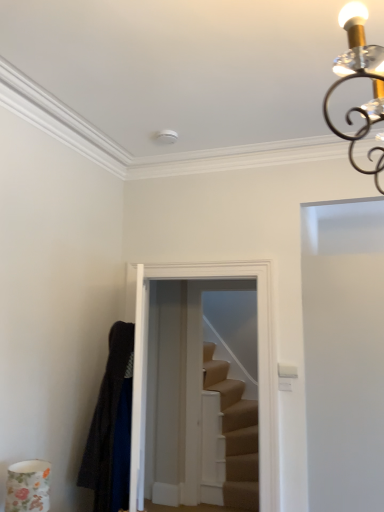
Image resolution: width=384 pixels, height=512 pixels. Describe the element at coordinates (344, 354) in the screenshot. I see `white matte door at right` at that location.

You are a GUI agent. You are given a task and a screenshot of the screen. Output one action in this format:
    pyautogui.click(x=<x>, y=<y>)
    Task: Click on the dark woolen robe at left
    
    Given the screenshot: What is the action you would take?
    pyautogui.click(x=111, y=426)

At what (x,y) coordinates should I click in order to perform the action: click on beige carpeted stairs at center. Please return your answer as a coordinate pair (x, y). This screenshot has height=512, width=384. Looking at the image, I should click on (235, 433).

Are beige carpeted stairs at center and white matte door at right making contact?

beige carpeted stairs at center is not next to white matte door at right, and they're not touching.

Is beige carpeted stairs at center smaller than white matte door at right?

Indeed, beige carpeted stairs at center has a smaller size compared to white matte door at right.

How different are the orientations of beige carpeted stairs at center and white matte door at right in degrees?

The angle between the facing direction of beige carpeted stairs at center and the facing direction of white matte door at right is 90 degrees.

Which is less distant, (253,488) or (351,474)?

Point (253,488) is farther from the camera than point (351,474).

Based on their sizes in the image, would you say clear glass door at center is bigger or smaller than white matte door at right?

clear glass door at center is smaller than white matte door at right.

From the image's perspective, between clear glass door at center and white matte door at right, which one is located above?

clear glass door at center, from the image's perspective.

Between clear glass door at center and white matte door at right, which one has more height?

white matte door at right.

Is the position of clear glass door at center more distant than that of white matte door at right?

Yes.

From the image's perspective, is white matte door at right below clear glass door at center?

Yes, from the image's perspective, white matte door at right is beneath clear glass door at center.

Is white matte door at right facing towards clear glass door at center?

No, white matte door at right is not oriented towards clear glass door at center.

Considering the relative sizes of white matte door at right and clear glass door at center in the image provided, is white matte door at right thinner than clear glass door at center?

In fact, white matte door at right might be wider than clear glass door at center.

In the image, is white matte door at right positioned in front of or behind clear glass door at center?

Clearly, white matte door at right is in front of clear glass door at center.

Considering the sizes of objects beige carpeted stairs at center and clear glass door at center in the image provided, who is wider, beige carpeted stairs at center or clear glass door at center?

With larger width is clear glass door at center.

Which object is further away from the camera, beige carpeted stairs at center or clear glass door at center?

beige carpeted stairs at center is further from the camera.

From the image's perspective, is beige carpeted stairs at center below clear glass door at center?

Correct, beige carpeted stairs at center appears lower than clear glass door at center in the image.

Is dark woolen robe at left oriented away from white matte door at right?

No.

Consider the image. From a real-world perspective, is dark woolen robe at left above or below white matte door at right?

dark woolen robe at left is above white matte door at right.

How distant is dark woolen robe at left from white matte door at right?

dark woolen robe at left is 1.31 meters away from white matte door at right.

Between dark woolen robe at left and white matte door at right, which one has more height?

white matte door at right is taller.

Is white matte door at right taller or shorter than dark woolen robe at left?

In the image, white matte door at right appears to be taller than dark woolen robe at left.

From a real-world perspective, does white matte door at right sit lower than dark woolen robe at left?

Yes, from a real-world perspective, white matte door at right is under dark woolen robe at left.

Is white matte door at right oriented away from dark woolen robe at left?

No.

Considering the relative sizes of dark woolen robe at left and beige carpeted stairs at center in the image provided, is dark woolen robe at left thinner than beige carpeted stairs at center?

No.

Are dark woolen robe at left and beige carpeted stairs at center making contact?

dark woolen robe at left and beige carpeted stairs at center are not in contact.

From the image's perspective, is dark woolen robe at left located above or below beige carpeted stairs at center?

dark woolen robe at left is above beige carpeted stairs at center.

Is dark woolen robe at left looking in the opposite direction of beige carpeted stairs at center?

dark woolen robe at left does not have its back to beige carpeted stairs at center.

This screenshot has height=512, width=384. I want to click on door that is on the right side of beige carpeted stairs at center, so click(x=344, y=354).

Where is `glass door that appears on the left of white matte door at right`? The height and width of the screenshot is (512, 384). glass door that appears on the left of white matte door at right is located at coordinates (258, 364).

Considering their positions, is beige carpeted stairs at center positioned further to dark woolen robe at left than clear glass door at center?

Based on the image, beige carpeted stairs at center appears to be further to dark woolen robe at left.

When comparing their distances from dark woolen robe at left, does clear glass door at center or beige carpeted stairs at center seem closer?

clear glass door at center is positioned closer to the anchor dark woolen robe at left.

Which object lies nearer to the anchor point beige carpeted stairs at center, dark woolen robe at left or white matte door at right?

white matte door at right lies closer to beige carpeted stairs at center than the other object.

When comparing their distances from dark woolen robe at left, does white matte door at right or beige carpeted stairs at center seem closer?

white matte door at right.

Estimate the real-world distances between objects in this image. Which object is further from beige carpeted stairs at center, white matte door at right or dark woolen robe at left?

dark woolen robe at left is positioned further to the anchor beige carpeted stairs at center.

Which object lies further to the anchor point white matte door at right, clear glass door at center or beige carpeted stairs at center?

Among the two, beige carpeted stairs at center is located further to white matte door at right.

Considering their positions, is white matte door at right positioned further to clear glass door at center than beige carpeted stairs at center?

beige carpeted stairs at center is further to clear glass door at center.

Looking at the image, which one is located closer to clear glass door at center, beige carpeted stairs at center or white matte door at right?

white matte door at right is closer to clear glass door at center.

I want to click on glass door between white matte door at right and beige carpeted stairs at center in the front-back direction, so click(258, 364).

Find the location of a particular element. Image resolution: width=384 pixels, height=512 pixels. glass door between dark woolen robe at left and beige carpeted stairs at center from front to back is located at coordinates (258, 364).

The image size is (384, 512). Find the location of `stairs situated between dark woolen robe at left and white matte door at right from left to right`. stairs situated between dark woolen robe at left and white matte door at right from left to right is located at coordinates (235, 433).

The height and width of the screenshot is (512, 384). Identify the location of glass door between dark woolen robe at left and white matte door at right from left to right. (258, 364).